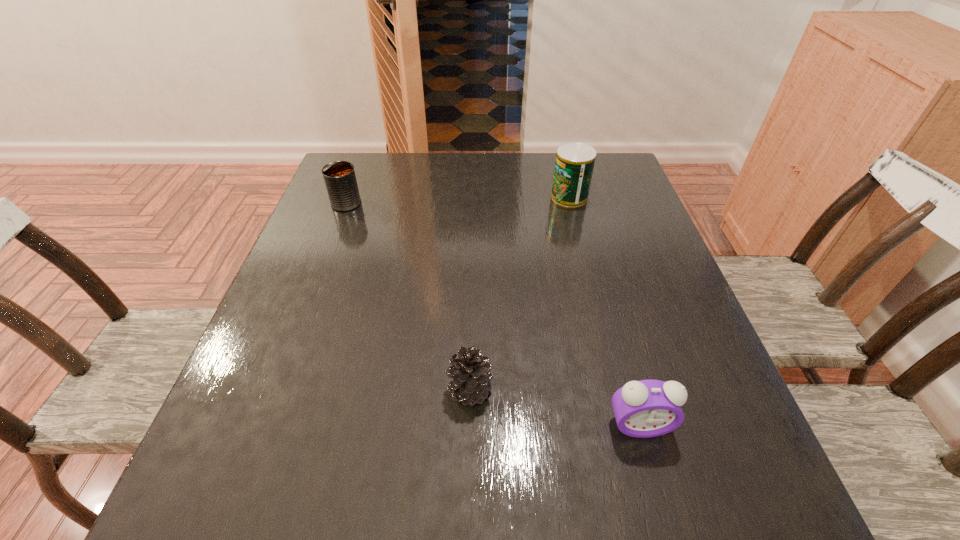
You are a GUI agent. You are given a task and a screenshot of the screen. Output one action in this format:
    pyautogui.click(x=<x>, y=<y>)
    Task: Click on the can at the right edge
    The height and width of the screenshot is (540, 960).
    Given the screenshot: What is the action you would take?
    pyautogui.click(x=574, y=164)

The image size is (960, 540). Identify the location of alarm clock that is positioned at the right edge. (648, 408).

The image size is (960, 540). I want to click on object present at the far left corner, so click(x=339, y=176).

You are a GUI agent. You are given a task and a screenshot of the screen. Output one action in this format:
    pyautogui.click(x=<x>, y=<y>)
    Task: Click on the object that is positioned at the far right corner
    The image size is (960, 540).
    Given the screenshot: What is the action you would take?
    pyautogui.click(x=574, y=164)

The width and height of the screenshot is (960, 540). What are the coordinates of `free space at the far edge of the desktop` in the screenshot? It's located at click(412, 165).

Where is `vacant area at the near edge of the desktop`? The width and height of the screenshot is (960, 540). vacant area at the near edge of the desktop is located at coordinates (435, 510).

What are the coordinates of `free space at the left edge` in the screenshot? It's located at (298, 263).

This screenshot has height=540, width=960. I want to click on vacant space at the right edge of the desktop, so [x=596, y=233].

Where is `free location at the far right corner`? This screenshot has width=960, height=540. free location at the far right corner is located at coordinates (612, 156).

Locate an element on the screen. This screenshot has height=540, width=960. vacant area that lies between the pinecone and the nearest object is located at coordinates (554, 408).